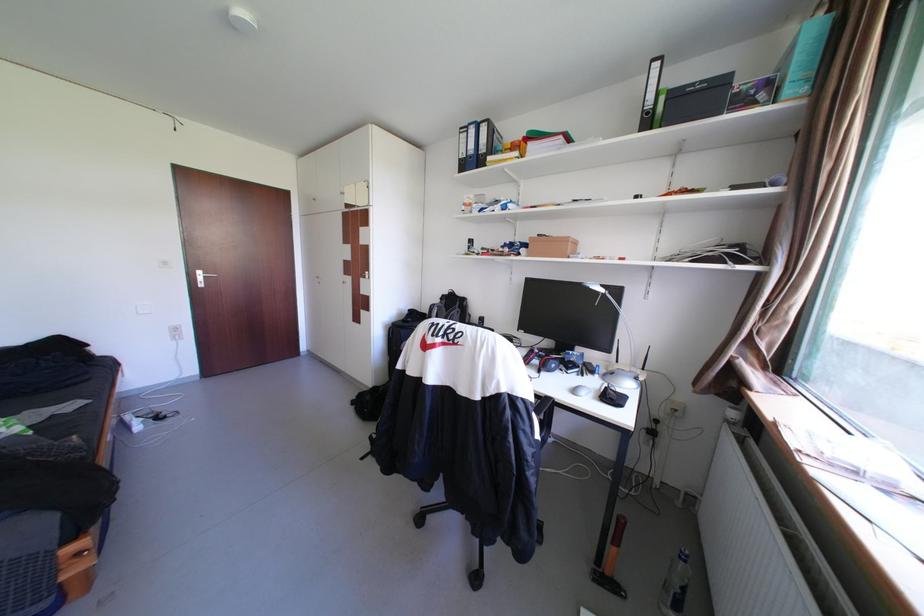
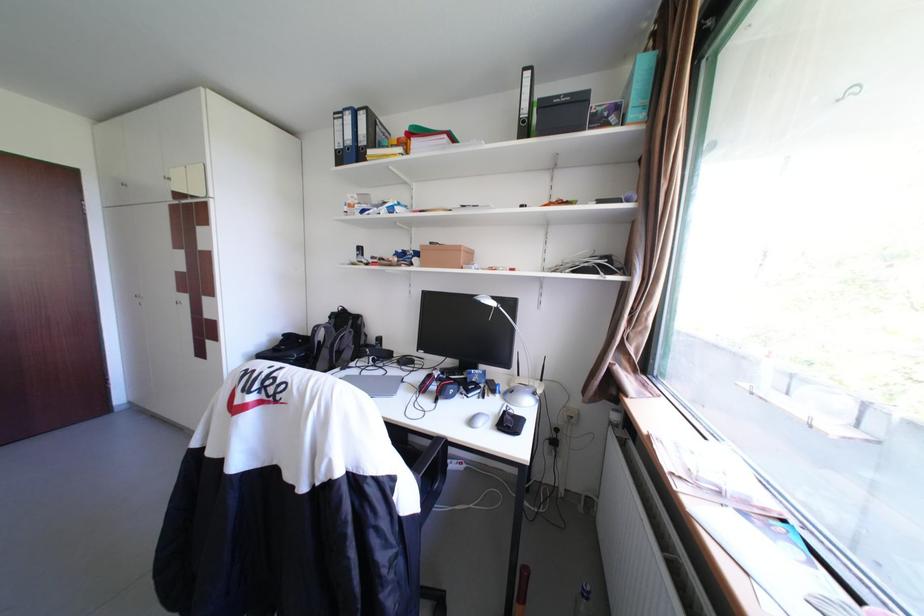
Where in the second image is the point corresponding to point (475, 166) from the first image?

(351, 158)